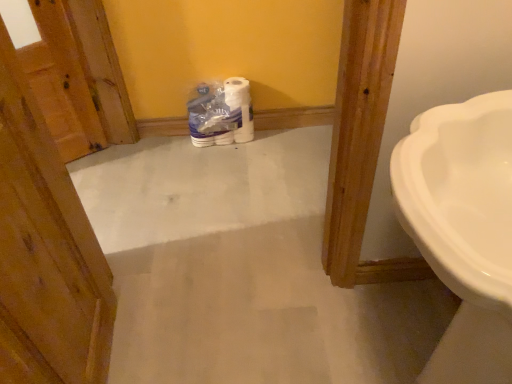
Question: From a real-world perspective, is wooden door at left on top of white glossy sink at right?

Choices:
 (A) yes
 (B) no

Answer: (A)

Question: Does wooden door at left have a smaller size compared to white glossy sink at right?

Choices:
 (A) no
 (B) yes

Answer: (B)

Question: Is wooden door at left facing towards white glossy sink at right?

Choices:
 (A) yes
 (B) no

Answer: (A)

Question: Is white glossy sink at right surrounded by wooden door at left?

Choices:
 (A) yes
 (B) no

Answer: (B)

Question: From a real-world perspective, is wooden door at left physically below white glossy sink at right?

Choices:
 (A) yes
 (B) no

Answer: (B)

Question: From their relative heights in the image, would you say white glossy sink at right is taller or shorter than wooden door at left?

Choices:
 (A) short
 (B) tall

Answer: (A)

Question: Considering the relative positions of white glossy sink at right and wooden door at left in the image provided, is white glossy sink at right to the left or to the right of wooden door at left?

Choices:
 (A) left
 (B) right

Answer: (B)

Question: Is white glossy sink at right in front of or behind wooden door at left in the image?

Choices:
 (A) behind
 (B) front

Answer: (A)

Question: From a real-world perspective, relative to wooden door at left, is white glossy sink at right vertically above or below?

Choices:
 (A) above
 (B) below

Answer: (B)

Question: In terms of width, does white glossy toilet paper at center look wider or thinner when compared to white glossy sink at right?

Choices:
 (A) wide
 (B) thin

Answer: (B)

Question: Is white glossy toilet paper at center bigger or smaller than white glossy sink at right?

Choices:
 (A) big
 (B) small

Answer: (B)

Question: Considering the relative positions of white glossy toilet paper at center and white glossy sink at right in the image provided, is white glossy toilet paper at center to the left or to the right of white glossy sink at right?

Choices:
 (A) right
 (B) left

Answer: (B)

Question: Is white glossy toilet paper at center taller or shorter than white glossy sink at right?

Choices:
 (A) tall
 (B) short

Answer: (B)

Question: Considering the positions of wooden door at left and white glossy toilet paper at center in the image, is wooden door at left bigger or smaller than white glossy toilet paper at center?

Choices:
 (A) big
 (B) small

Answer: (A)

Question: From the image's perspective, is wooden door at left above or below white glossy toilet paper at center?

Choices:
 (A) above
 (B) below

Answer: (B)